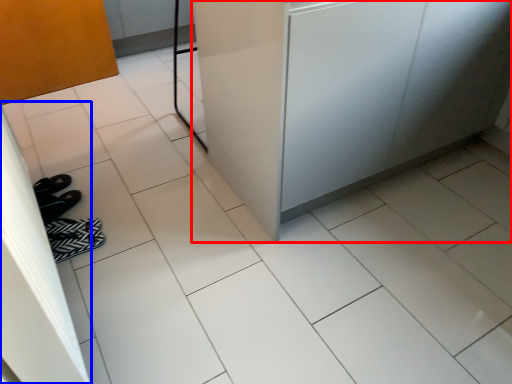
Question: Among these objects, which one is nearest to the camera, counter (highlighted by a red box) or screen door (highlighted by a blue box)?

Choices:
 (A) counter
 (B) screen door

Answer: (B)